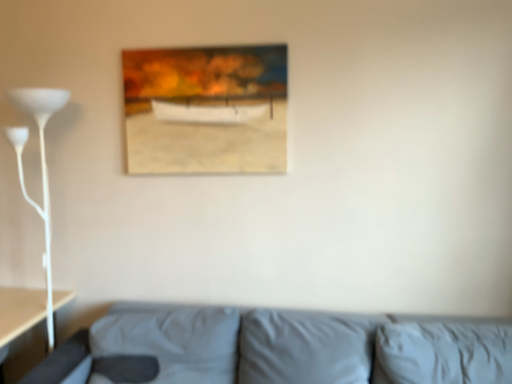
Where is `vacant space situated above wooden frame at upper center (from a real-world perspective)`? Image resolution: width=512 pixels, height=384 pixels. vacant space situated above wooden frame at upper center (from a real-world perspective) is located at coordinates (201, 47).